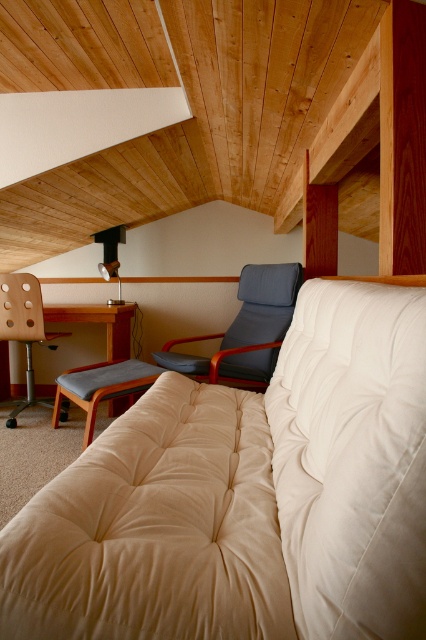
You are sitting on the gray fabric stool at center and want to reach the remote control placed on the beige fabric couch at center. Can you easily reach it without moving your position?

The beige fabric couch at center is above the gray fabric stool at center, so you can easily reach the remote control placed on the beige fabric couch at center from your current position on the gray fabric stool at center since it is within arm

You are standing in the living room and want to walk from the sofa to the desk. Which point, point (310,374) or point (31,314), is closer to you as you start moving towards the desk?

Point (310,374) is closer to the viewer than point (31,314), so you would reach point (310,374) first when moving towards the desk.

Consider the image. You are standing at the entrance of the loft and want to sit down to rest. The gray fabric stool at center is located at point (101,387). Is the gray fabric stool at center closer to the sofa or the wooden desk?

The gray fabric stool at center is located at point (101,387), which is closer to the sofa than the wooden desk.